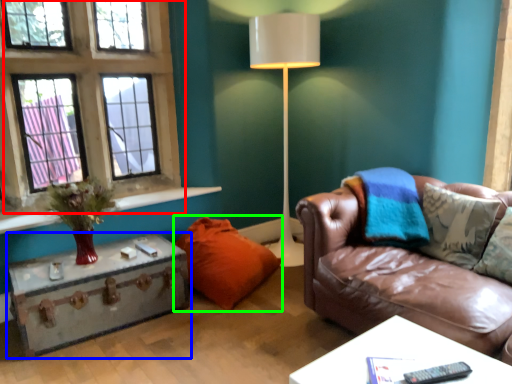
Question: Considering the real-world distances, which object is closest to window (highlighted by a red box)? table (highlighted by a blue box) or pillow (highlighted by a green box).

Choices:
 (A) table
 (B) pillow

Answer: (A)